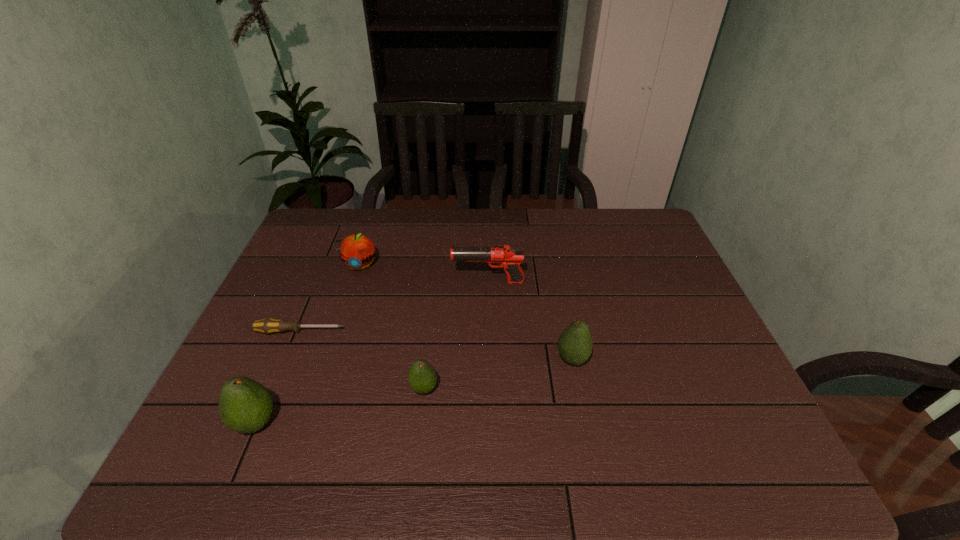
The height and width of the screenshot is (540, 960). In order to click on free point that keeps the avocados evenly spaced on the right in this screenshot , I will do `click(704, 333)`.